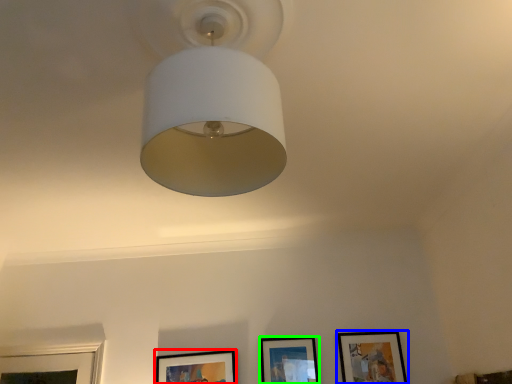
Question: Estimate the real-world distances between objects in this image. Which object is farther from picture frame (highlighted by a red box), picture frame (highlighted by a blue box) or picture frame (highlighted by a green box)?

Choices:
 (A) picture frame
 (B) picture frame

Answer: (A)